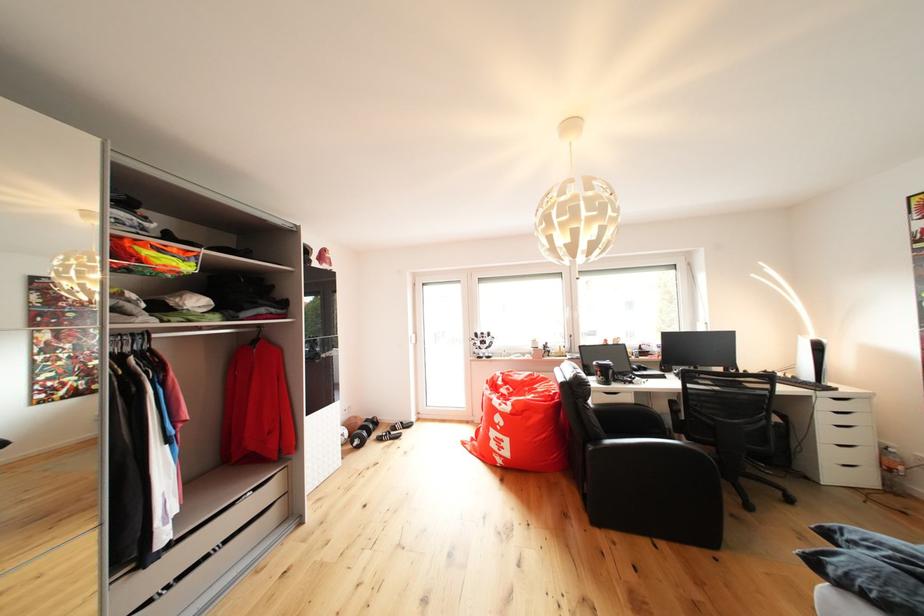
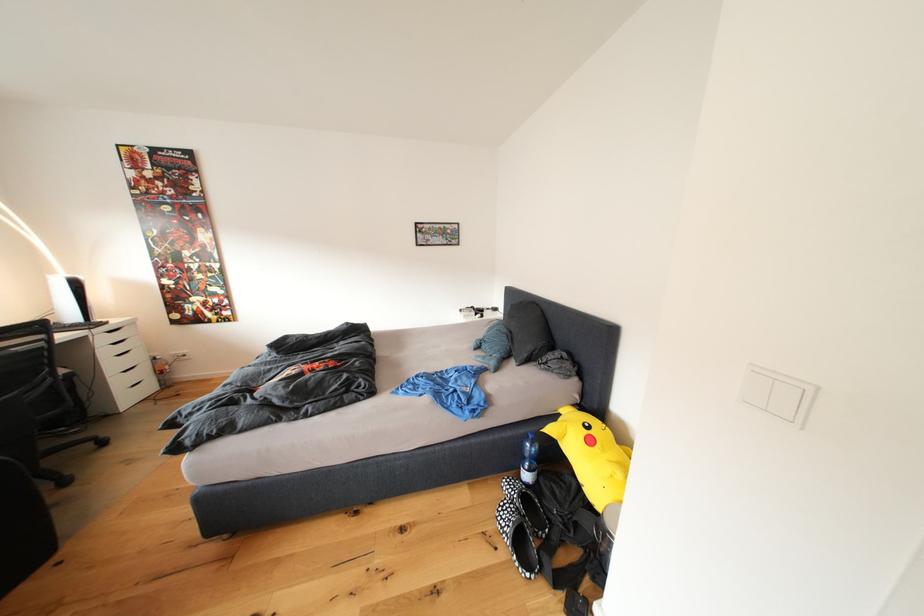
Question: The camera is either moving clockwise (left) or counter-clockwise (right) around the object. The first image is from the beginning of the video and the second image is from the end. Is the camera moving left or right when shooting the video?

Choices:
 (A) Left
 (B) Right

Answer: (A)